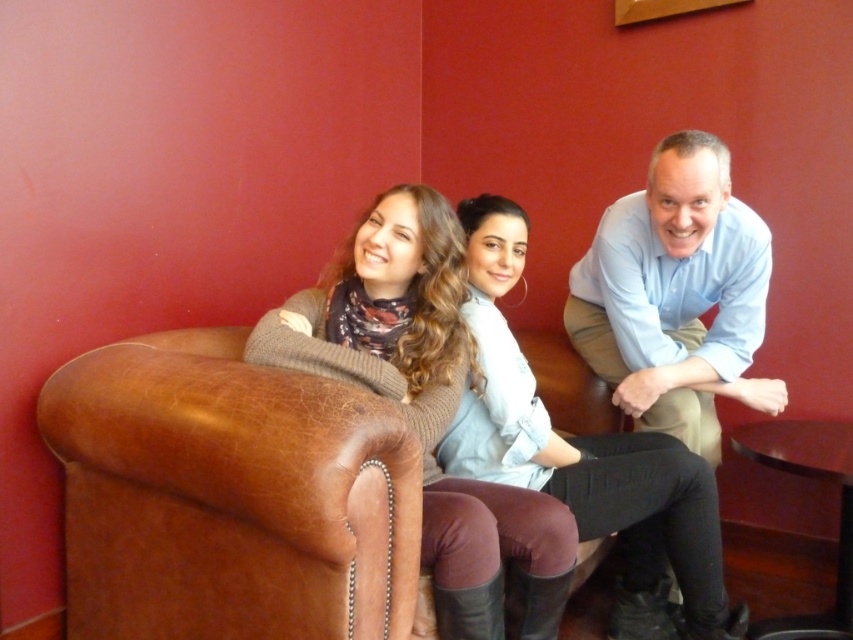
Question: Is light blue shirt at center positioned in front of light blue denim shirt at center?

Choices:
 (A) no
 (B) yes

Answer: (A)

Question: Which of the following is the farthest from the observer?

Choices:
 (A) light blue denim shirt at center
 (B) matte brown sweater at center

Answer: (A)

Question: Which object is the farthest from the light blue shirt at center?

Choices:
 (A) light blue denim shirt at center
 (B) matte brown sweater at center

Answer: (B)

Question: Is light blue shirt at center thinner than light blue denim shirt at center?

Choices:
 (A) no
 (B) yes

Answer: (B)

Question: Considering the relative positions of matte brown sweater at center and light blue shirt at center in the image provided, where is matte brown sweater at center located with respect to light blue shirt at center?

Choices:
 (A) left
 (B) right

Answer: (A)

Question: Which point appears farthest from the camera in this image?

Choices:
 (A) (462, 465)
 (B) (691, 163)

Answer: (B)